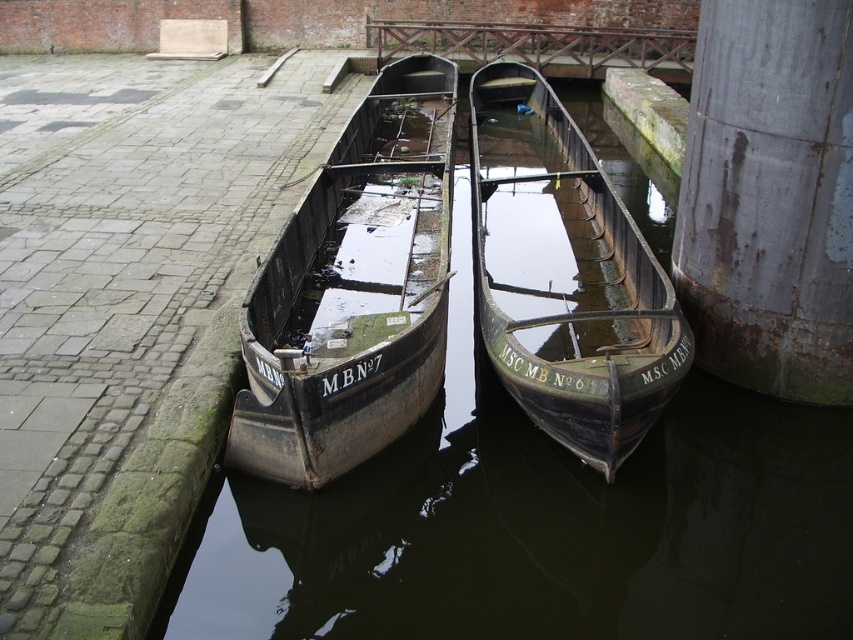
You are a delivery person carrying a package that needs to be placed exactly between the rusty metal pillar at right and the green wooden boat at center. Can you fit the package there if it requires 2 meters of space?

The distance between the rusty metal pillar at right and the green wooden boat at center is 2.51 meters, so yes, the package requiring 2 meters of space can fit between them.

You are standing on the walkway next to the canal. You see the dark brown water at center and the green wooden boat at center. Which one is closer to you?

The dark brown water at center is closer to you because it is in front of the green wooden boat at center.

You are standing on the paved walkway next to the canal where the two old wooden boats are docked. You need to secure a rope to the rusty metal pillar at right to tie up a new boat. Where exactly should you place the rope on the pillar to ensure it aligns with the coordinates provided?

The rusty metal pillar at right should have the rope placed at the coordinates point (769,196) to align with the specified location.